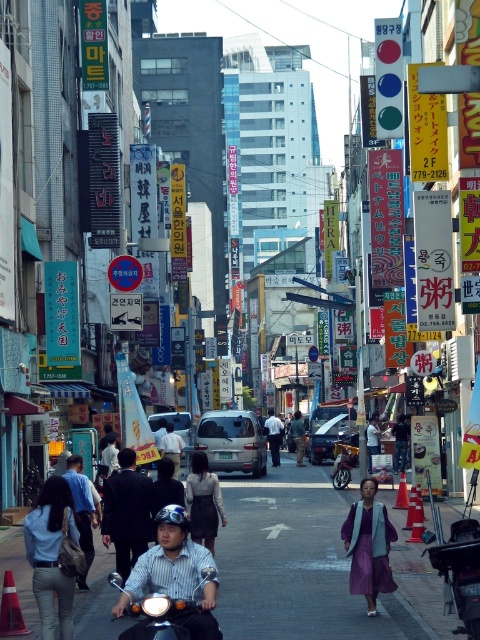
You are standing on the street and see two points marked on the ground. One is at point (x=399, y=467) and the other at point (x=166, y=456). Which point is closer to you?

Point (x=166, y=456) is closer to you because it is less further to the viewer than point (x=399, y=467).

You are standing at the center of the bustling urban street scene. You see a denim jacket at lower left. Where exactly is the denim jacket located in terms of coordinates?

The denim jacket at lower left is located at point (x=51, y=556).